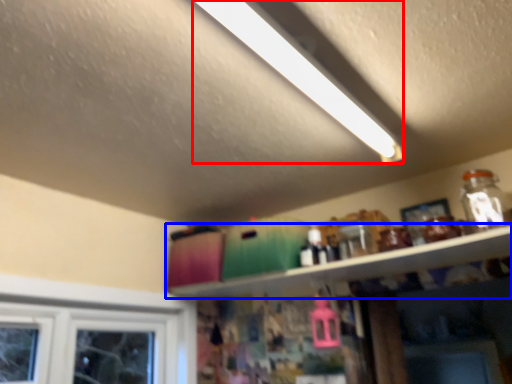
Question: Among these objects, which one is farthest to the camera, light (highlighted by a red box) or shelf (highlighted by a blue box)?

Choices:
 (A) light
 (B) shelf

Answer: (B)